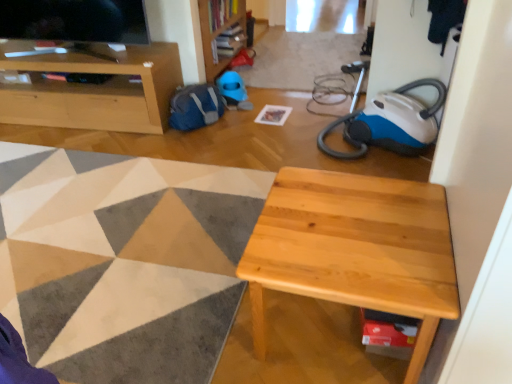
Image resolution: width=512 pixels, height=384 pixels. What do you see at coordinates (94, 89) in the screenshot?
I see `matte wood cabinet at upper left` at bounding box center [94, 89].

The image size is (512, 384). What do you see at coordinates (354, 249) in the screenshot?
I see `natural wood table at center` at bounding box center [354, 249].

Where is `wooden bookshelf at upper center`? This screenshot has width=512, height=384. wooden bookshelf at upper center is located at coordinates (218, 30).

Where is `matte wood cabinet at upper left`? The height and width of the screenshot is (384, 512). matte wood cabinet at upper left is located at coordinates (94, 89).

Measure the distance between white paper at center and wooden bookshelf at upper center.

The distance of white paper at center from wooden bookshelf at upper center is 30.29 inches.

Which of these two, white paper at center or wooden bookshelf at upper center, is thinner?

With smaller width is white paper at center.

Is white paper at center far from wooden bookshelf at upper center?

No, white paper at center is not far from wooden bookshelf at upper center.

From the image's perspective, who appears lower, white paper at center or wooden bookshelf at upper center?

white paper at center, from the image's perspective.

Could you tell me if natural wood table at center is turned towards wooden bookshelf at upper center?

No.

Could wooden bookshelf at upper center be considered to be inside natural wood table at center?

No, natural wood table at center does not contain wooden bookshelf at upper center.

Is natural wood table at center to the left of wooden bookshelf at upper center from the viewer's perspective?

No, natural wood table at center is not to the left of wooden bookshelf at upper center.

Considering the relative sizes of natural wood table at center and wooden bookshelf at upper center in the image provided, is natural wood table at center bigger than wooden bookshelf at upper center?

Actually, natural wood table at center might be smaller than wooden bookshelf at upper center.

In the image, is wooden bookshelf at upper center on the left side or the right side of natural wood table at center?

From the image, it's evident that wooden bookshelf at upper center is to the left of natural wood table at center.

Do you think wooden bookshelf at upper center is within natural wood table at center, or outside of it?

wooden bookshelf at upper center is spatially situated outside natural wood table at center.

How much distance is there between wooden bookshelf at upper center and natural wood table at center?

wooden bookshelf at upper center is 7.23 feet away from natural wood table at center.

From a real-world perspective, which is physically below, wooden bookshelf at upper center or natural wood table at center?

In real-world perspective, natural wood table at center is lower.

The image size is (512, 384). Identify the location of cabinetry above the natural wood table at center (from a real-world perspective). pyautogui.click(x=94, y=89).

Consider the image. Between natural wood table at center and matte wood cabinet at upper left, which one appears on the left side from the viewer's perspective?

From the viewer's perspective, matte wood cabinet at upper left appears more on the left side.

From the image's perspective, is natural wood table at center located above or below matte wood cabinet at upper left?

Based on their image positions, natural wood table at center is located beneath matte wood cabinet at upper left.

Can you confirm if natural wood table at center is thinner than matte wood cabinet at upper left?

In fact, natural wood table at center might be wider than matte wood cabinet at upper left.

Considering the positions of objects wooden bookshelf at upper center and white paper at center in the image provided, who is more to the left, wooden bookshelf at upper center or white paper at center?

From the viewer's perspective, wooden bookshelf at upper center appears more on the left side.

From a real-world perspective, relative to white paper at center, is wooden bookshelf at upper center vertically above or below?

wooden bookshelf at upper center is situated higher than white paper at center in the real world.

Based on the photo, which is correct: wooden bookshelf at upper center is inside white paper at center, or outside of it?

wooden bookshelf at upper center is not enclosed by white paper at center.

Which of these two, wooden bookshelf at upper center or white paper at center, stands taller?

wooden bookshelf at upper center is taller.

Considering the sizes of natural wood table at center and white paper at center in the image, is natural wood table at center taller or shorter than white paper at center?

natural wood table at center is taller than white paper at center.

Is natural wood table at center oriented towards white paper at center?

No, natural wood table at center is not facing towards white paper at center.

Does natural wood table at center come behind white paper at center?

That is False.

How far apart are white paper at center and matte wood cabinet at upper left?

1.11 meters.

Is matte wood cabinet at upper left a part of white paper at center?

No, matte wood cabinet at upper left is not a part of white paper at center.

Consider the image. From a real-world perspective, is white paper at center located beneath matte wood cabinet at upper left?

Yes, from a real-world perspective, white paper at center is beneath matte wood cabinet at upper left.

Is white paper at center looking in the opposite direction of matte wood cabinet at upper left?

That's not correct — white paper at center is not looking away from matte wood cabinet at upper left.

Where is `bookshelf above the white paper at center (from the image's perspective)`? This screenshot has width=512, height=384. bookshelf above the white paper at center (from the image's perspective) is located at coordinates (218, 30).

This screenshot has width=512, height=384. I want to click on table that appears below the wooden bookshelf at upper center (from the image's perspective), so click(x=354, y=249).

Based on their spatial positions, is white paper at center or natural wood table at center closer to matte wood cabinet at upper left?

The object closer to matte wood cabinet at upper left is white paper at center.

Looking at the image, which one is located further to wooden bookshelf at upper center, matte wood cabinet at upper left or natural wood table at center?

natural wood table at center is positioned further to the anchor wooden bookshelf at upper center.

Based on their spatial positions, is matte wood cabinet at upper left or wooden bookshelf at upper center closer to natural wood table at center?

matte wood cabinet at upper left lies closer to natural wood table at center than the other object.

When comparing their distances from white paper at center, does matte wood cabinet at upper left or wooden bookshelf at upper center seem further?

matte wood cabinet at upper left lies further to white paper at center than the other object.

Looking at this image, when comparing their distances from matte wood cabinet at upper left, does natural wood table at center or white paper at center seem closer?

white paper at center is positioned closer to the anchor matte wood cabinet at upper left.

Looking at the image, which one is located closer to matte wood cabinet at upper left, wooden bookshelf at upper center or white paper at center?

wooden bookshelf at upper center.

From the image, which object appears to be nearer to matte wood cabinet at upper left, wooden bookshelf at upper center or natural wood table at center?

wooden bookshelf at upper center is positioned closer to the anchor matte wood cabinet at upper left.

From the image, which object appears to be farther from matte wood cabinet at upper left, white paper at center or wooden bookshelf at upper center?

Among the two, white paper at center is located further to matte wood cabinet at upper left.

At what (x,y) coordinates should I click in order to perform the action: click on square between natural wood table at center and wooden bookshelf at upper center from front to back. Please return your answer as a coordinate pair (x, y). Looking at the image, I should click on (273, 115).

Locate an element on the screen. The image size is (512, 384). bookshelf between matte wood cabinet at upper left and white paper at center in the horizontal direction is located at coordinates (218, 30).

Identify the location of cabinetry located between natural wood table at center and wooden bookshelf at upper center in the depth direction. (94, 89).

Locate an element on the screen. cabinetry between natural wood table at center and white paper at center in the front-back direction is located at coordinates (94, 89).